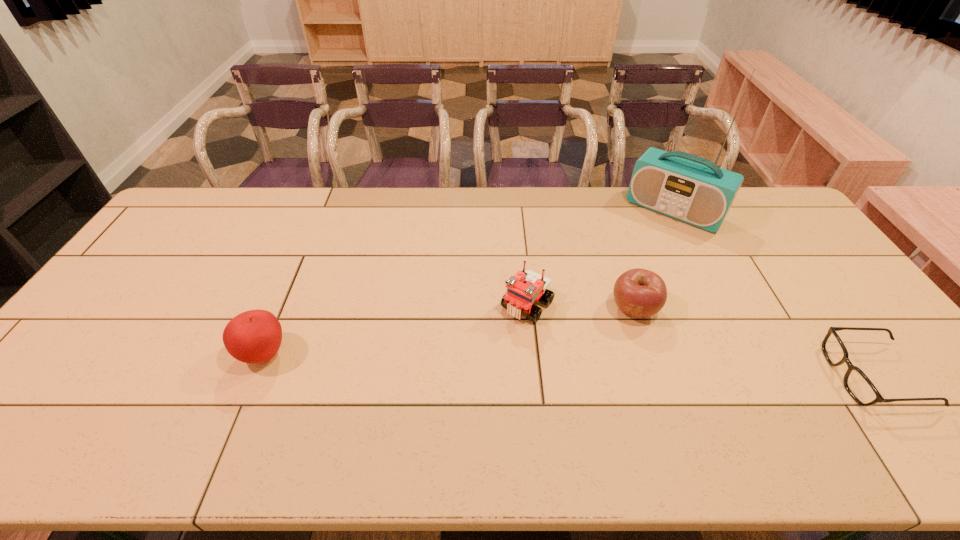
In the image, there is a desktop. Identify the location of free space at the far left corner. (190, 212).

You are a GUI agent. You are given a task and a screenshot of the screen. Output one action in this format:
    pyautogui.click(x=<x>, y=<y>)
    Task: Click on the vacant position at the far right corner of the desktop
    
    Given the screenshot: What is the action you would take?
    pyautogui.click(x=774, y=198)

Find the location of a particular element. vacant space that's between the leftmost object and the fourth tallest object is located at coordinates (449, 331).

Where is `vacant area that lies between the left apple and the rightmost object`? This screenshot has height=540, width=960. vacant area that lies between the left apple and the rightmost object is located at coordinates (569, 365).

Where is `free spot between the third object from left to right and the second object from right to left`? This screenshot has width=960, height=540. free spot between the third object from left to right and the second object from right to left is located at coordinates (654, 260).

The image size is (960, 540). Identify the location of free space between the Lego and the leftmost object. (396, 329).

Find the location of a particular element. free spot between the second object from left to right and the leftmost object is located at coordinates (396, 329).

What are the coordinates of `blank region between the leftmost object and the spectacles` in the screenshot? It's located at (569, 365).

Identify the location of vacant space that is in between the farthest object and the farther apple. Image resolution: width=960 pixels, height=540 pixels. (654, 260).

You are a GUI agent. You are given a task and a screenshot of the screen. Output one action in this format:
    pyautogui.click(x=<x>, y=<y>)
    Task: Click on the free space between the second object from right to left and the leftmost object
    The width and height of the screenshot is (960, 540).
    Given the screenshot: What is the action you would take?
    pyautogui.click(x=469, y=282)